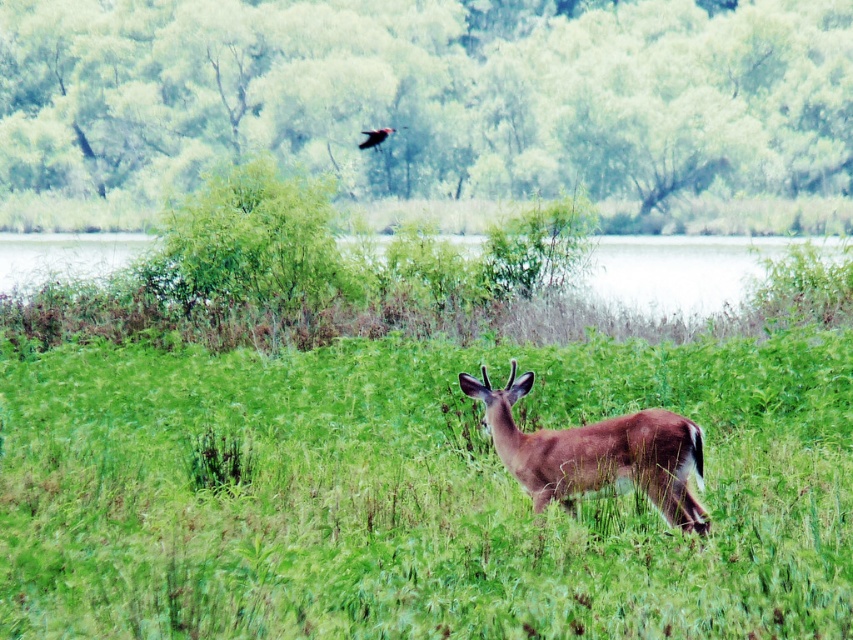
You are a hiker who wants to place a marker at the exact center of the image. You see the green grassy area at center. Is the green grassy at center located exactly at the center of the image?

The green grassy at center is located at point [416,493], which is not exactly at the center of the image. The center of the image would be at point [426,320].

You are standing in a natural setting and want to cross to the other side of the green grassy lake at center. If your walking distance is limited to 15 meters, can you safely make it across without needing to swim?

The green grassy lake at center is 15.56 meters from viewer. Since your walking distance is limited to 15 meters, you cannot safely cross it without needing to swim as the distance exceeds your limit.